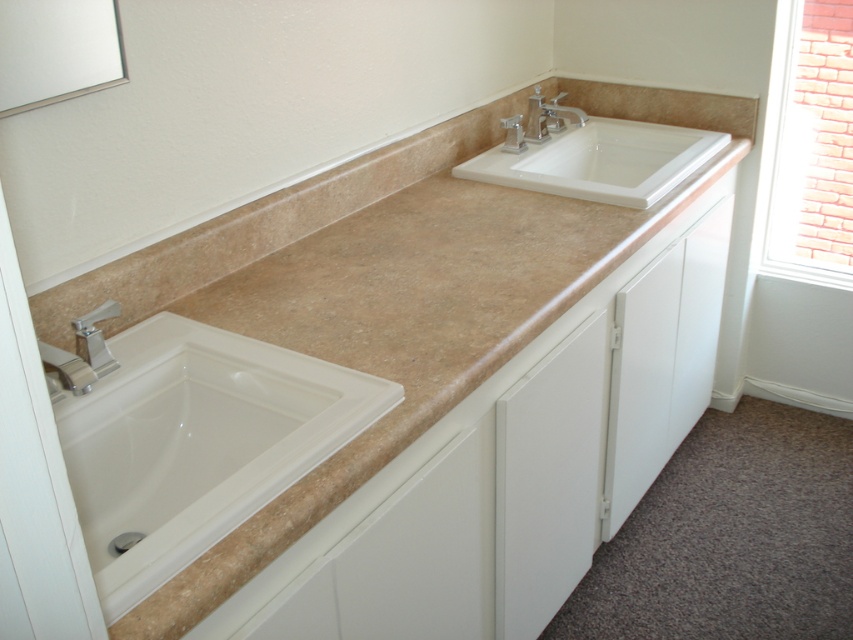
Question: Considering the relative positions of beige marble countertop at center and silver metallic faucet at left in the image provided, where is beige marble countertop at center located with respect to silver metallic faucet at left?

Choices:
 (A) above
 (B) below

Answer: (A)

Question: Considering the relative positions of white glossy sink at left and silver metallic faucet at left in the image provided, where is white glossy sink at left located with respect to silver metallic faucet at left?

Choices:
 (A) above
 (B) below

Answer: (B)

Question: Which point is farther to the camera?

Choices:
 (A) (720, 120)
 (B) (538, 141)
 (C) (122, 417)

Answer: (A)

Question: Which of the following is the closest to the observer?

Choices:
 (A) tap(820, 122)
 (B) tap(505, 136)

Answer: (B)

Question: In this image, where is white ceramic sink at upper right located relative to silver metallic faucet at upper center?

Choices:
 (A) left
 (B) right

Answer: (B)

Question: Based on their relative distances, which object is nearer to the beige marble countertop at center?

Choices:
 (A) white glossy sink at left
 (B) brick wall at upper right

Answer: (A)